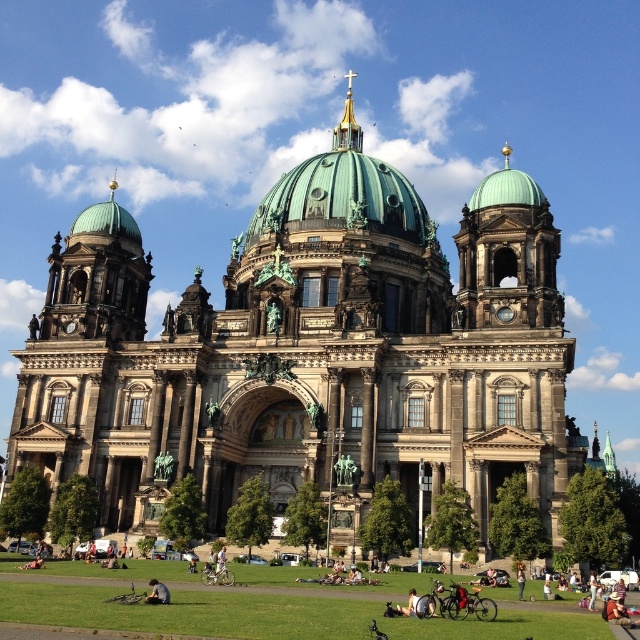
Question: Can you confirm if dark gray stone church at center is positioned to the right of dark gray fabric jacket at lower center?

Choices:
 (A) no
 (B) yes

Answer: (B)

Question: Which object appears closest to the camera in this image?

Choices:
 (A) dark gray stone church at center
 (B) dark gray fabric jacket at lower center

Answer: (B)

Question: Can you confirm if dark gray stone church at center is positioned to the left of dark gray fabric jacket at lower center?

Choices:
 (A) no
 (B) yes

Answer: (A)

Question: Observing the image, what is the correct spatial positioning of dark gray stone church at center in reference to dark gray fabric jacket at lower center?

Choices:
 (A) left
 (B) right

Answer: (B)